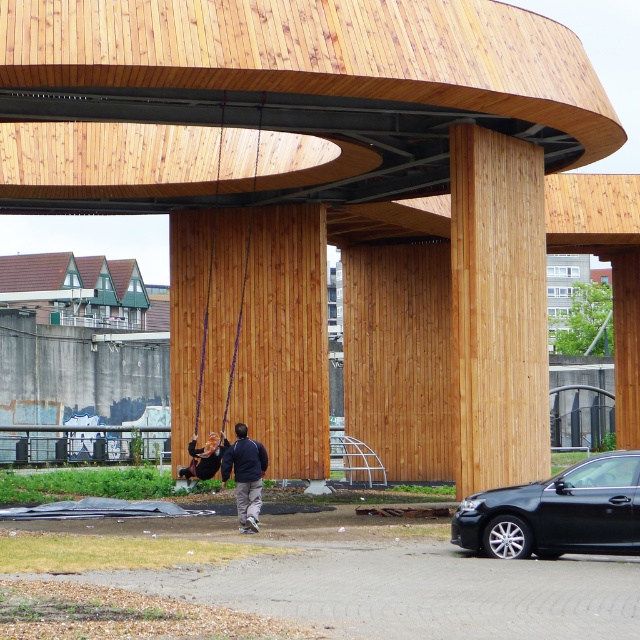
Question: Where is purple fabric swing at center located in relation to matte black swing at lower left in the image?

Choices:
 (A) below
 (B) above

Answer: (B)

Question: Based on their relative distances, which object is farther from the matte black swing at lower left?

Choices:
 (A) dark blue jacket at center
 (B) purple fabric swing at center
 (C) black metallic car at lower right

Answer: (C)

Question: Does black metallic car at lower right lie in front of dark blue jacket at center?

Choices:
 (A) no
 (B) yes

Answer: (B)

Question: Can you confirm if purple fabric swing at center is bigger than dark blue jacket at center?

Choices:
 (A) yes
 (B) no

Answer: (A)

Question: Which object is closer to the camera taking this photo?

Choices:
 (A) dark blue jacket at center
 (B) purple fabric swing at center
 (C) matte black swing at lower left

Answer: (A)

Question: Which point is farther from the camera taking this photo?

Choices:
 (A) (560, 509)
 (B) (205, 314)
 (C) (257, 467)

Answer: (B)